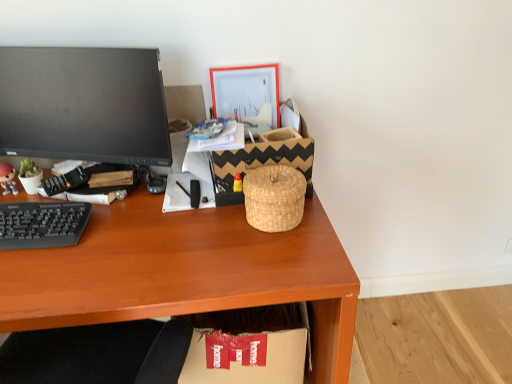
This screenshot has height=384, width=512. I want to click on free point above wooden desk at center (from a real-world perspective), so click(137, 235).